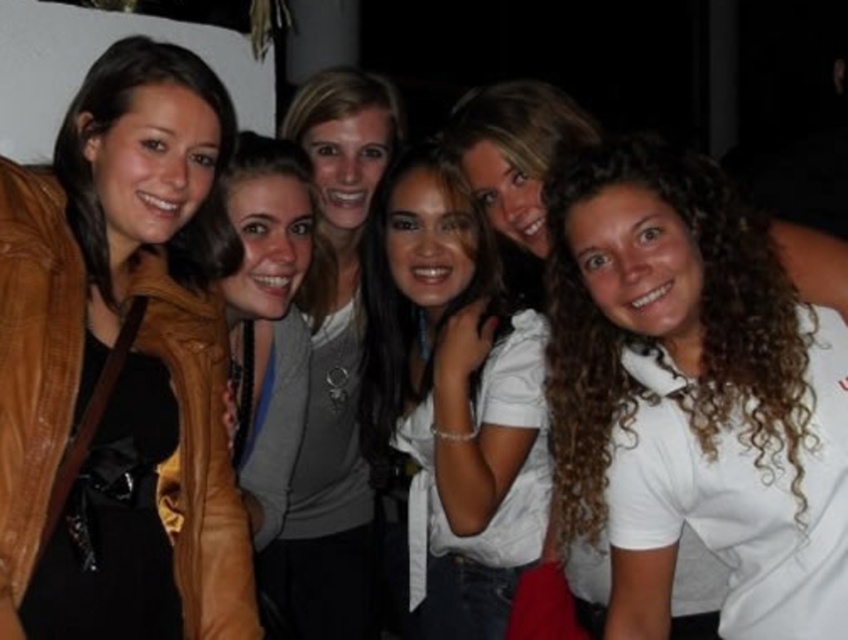
You are a photographer trying to adjust the lighting for a group photo. You notice the brown leather jacket at left and the matte gray sweater at center. Which clothing item requires more space to avoid being crowded in the frame?

The matte gray sweater at center requires more space because it has a larger size compared to the brown leather jacket at left, so it might need more room to avoid looking crowded in the frame.

You are a photographer trying to adjust the lighting for a group photo. You notice two items of clothing at the center of the image, the white matte shirt at center and the matte gray sweater at center. Which one is closer to the light source in this dimly lit setting?

The white matte shirt at center is positioned under the matte gray sweater at center, so the matte gray sweater at center is closer to the light source.

You are a photographer trying to adjust the lighting for a group photo. You notice the brown leather jacket at left and the white matte shirt at center. Which of these two items is positioned higher in the frame?

The brown leather jacket at left is located above the white matte shirt at center, so it is positioned higher in the frame.